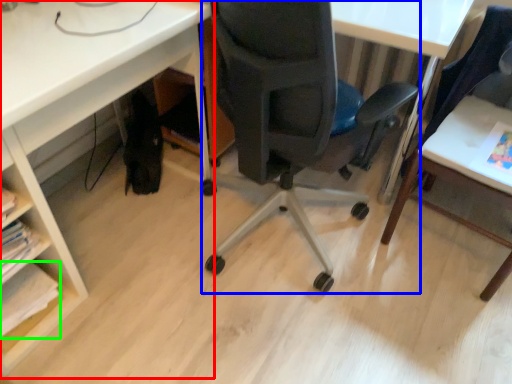
Question: Which is farther away from desk (highlighted by a red box)? chair (highlighted by a blue box) or book (highlighted by a green box)?

Choices:
 (A) chair
 (B) book

Answer: (B)